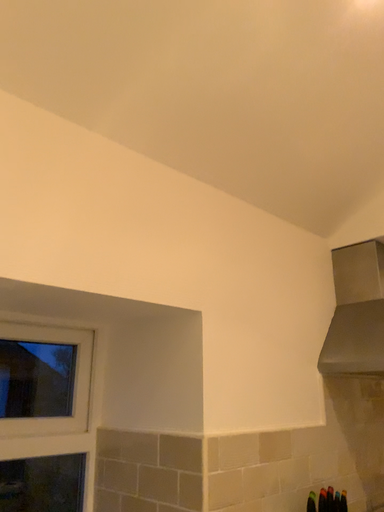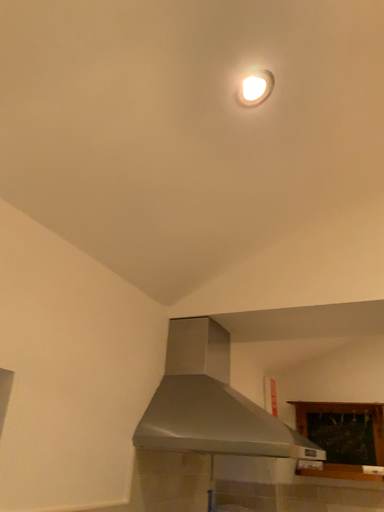
Question: Which way did the camera rotate in the video?

Choices:
 (A) rotated right
 (B) rotated left

Answer: (A)